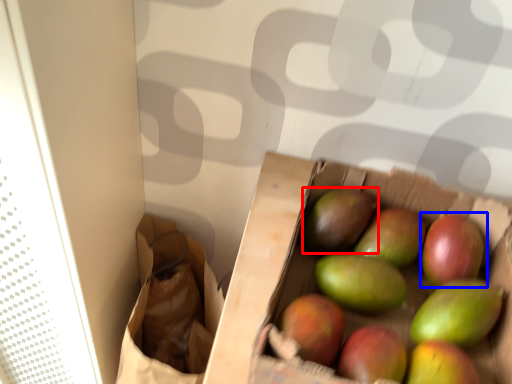
Question: Among these objects, which one is farthest to the camera, mango (highlighted by a red box) or grapefruit (highlighted by a blue box)?

Choices:
 (A) mango
 (B) grapefruit

Answer: (A)